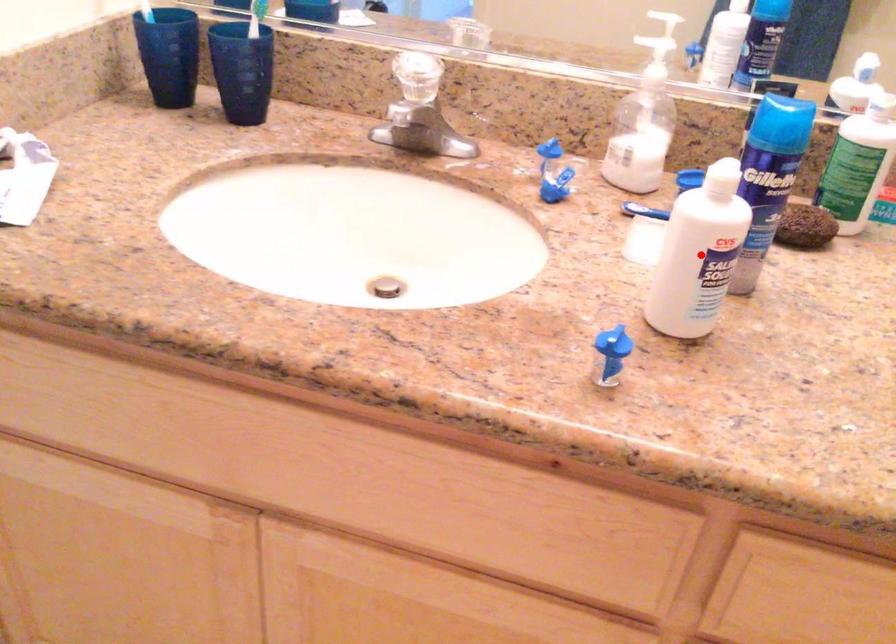
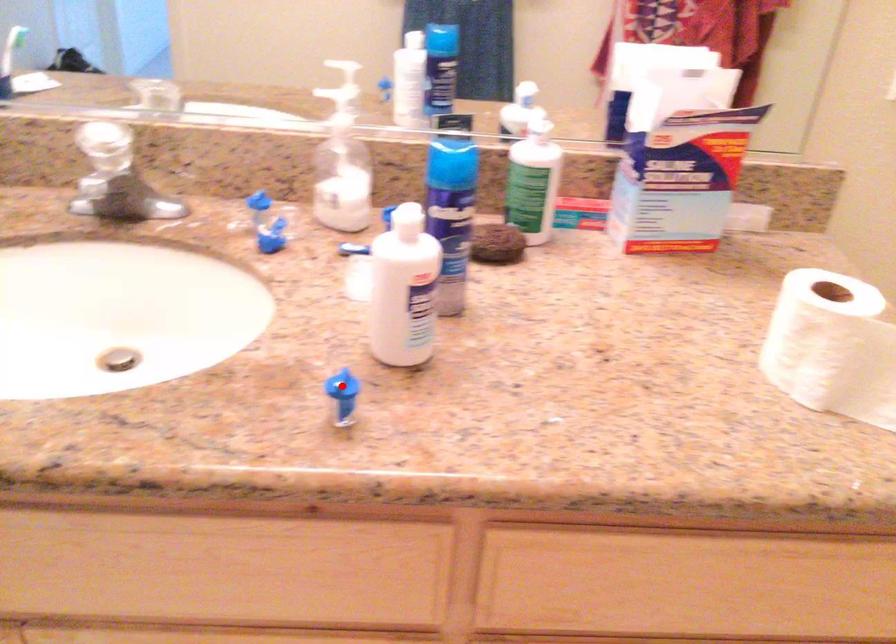
I am providing you with two images of the same scene from different viewpoints. A red point is marked on the first image and another point is marked on the second image. Is the red point in image1 aligned with the point shown in image2?

No